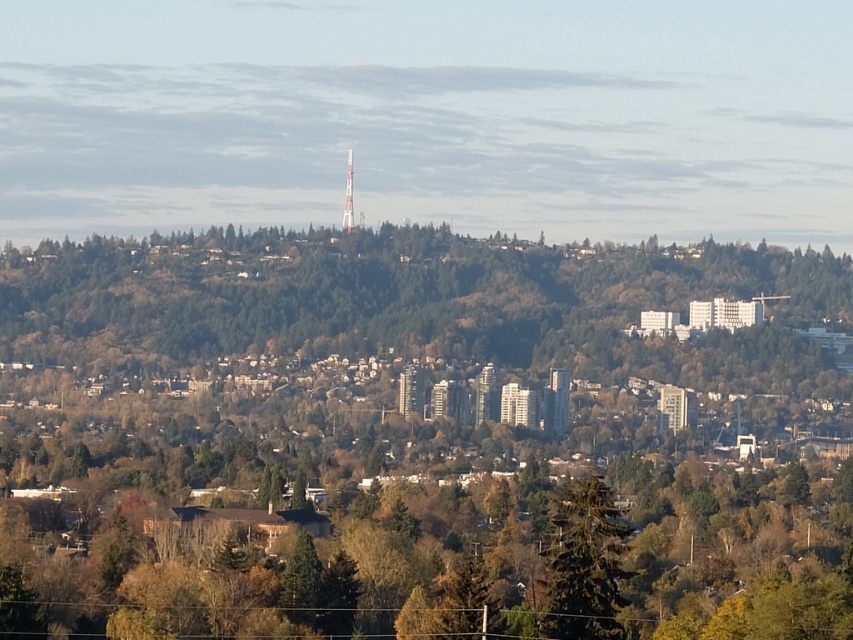
Question: Where is green matte tree at center located in relation to green textured tree at center in the image?

Choices:
 (A) above
 (B) below

Answer: (A)

Question: Is the position of green textured tree at center less distant than that of silver metallic tv tower at center?

Choices:
 (A) no
 (B) yes

Answer: (A)

Question: In this image, where is green textured tree at center located relative to silver metallic tv tower at center?

Choices:
 (A) above
 (B) below

Answer: (B)

Question: Among these objects, which one is farthest from the camera?

Choices:
 (A) green matte tree at center
 (B) silver metallic tv tower at center
 (C) green textured tree at center

Answer: (C)

Question: Which of the following is the farthest from the observer?

Choices:
 (A) green textured tree at center
 (B) silver metallic tv tower at center
 (C) green matte tree at center

Answer: (A)

Question: Which object is the closest to the green textured tree at center?

Choices:
 (A) green matte tree at center
 (B) silver metallic tv tower at center

Answer: (A)